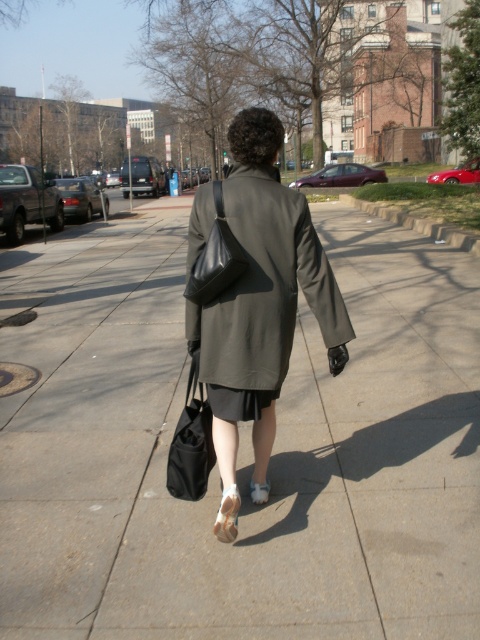
Consider the image. Is gray concrete sidewalk at center thinner than black fabric bag at lower center?

In fact, gray concrete sidewalk at center might be wider than black fabric bag at lower center.

Who is shorter, gray concrete sidewalk at center or black fabric bag at lower center?

With less height is black fabric bag at lower center.

Is point (387, 595) farther from camera compared to point (182, 496)?

That is False.

This screenshot has height=640, width=480. What are the coordinates of `gray concrete sidewalk at center` in the screenshot? It's located at (240, 448).

Where is `black leather bag at center`? The height and width of the screenshot is (640, 480). black leather bag at center is located at coordinates (216, 259).

Is black leather bag at center to the right of white suede sandal at lower center from the viewer's perspective?

No, black leather bag at center is not to the right of white suede sandal at lower center.

Is point (228, 250) closer to viewer compared to point (264, 490)?

Yes, point (228, 250) is in front of point (264, 490).

The image size is (480, 640). Identify the location of black leather bag at center. (216, 259).

Between point (186, 490) and point (219, 508), which one is positioned in front?

Point (219, 508) is in front.

Can you confirm if black fabric bag at lower center is wider than white leather sandal at lower center?

Yes.

The height and width of the screenshot is (640, 480). I want to click on black fabric bag at lower center, so [191, 442].

Locate an element on the screen. black fabric bag at lower center is located at coordinates (191, 442).